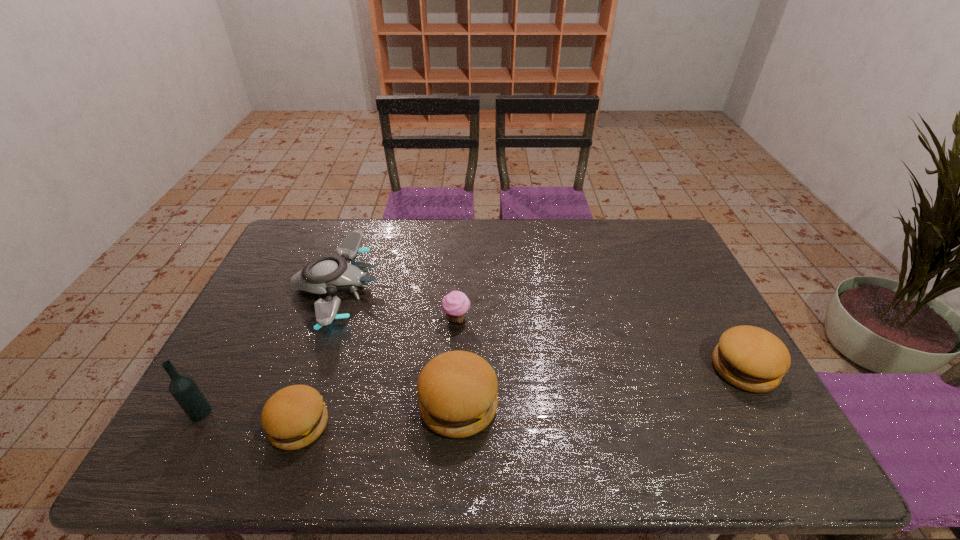
The image size is (960, 540). In order to click on free space between the second hamburger from left to right and the drone in this screenshot , I will do `click(398, 346)`.

Locate an element on the screen. vacant point located between the cupcake and the drone is located at coordinates (397, 303).

This screenshot has width=960, height=540. In order to click on free spot between the second hamburger from left to right and the rightmost hamburger in this screenshot , I will do `click(601, 387)`.

Find the location of a particular element. The image size is (960, 540). vacant area between the drone and the cupcake is located at coordinates (397, 303).

You are a GUI agent. You are given a task and a screenshot of the screen. Output one action in this format:
    pyautogui.click(x=<x>, y=<y>)
    Task: Click on the unoccupied position between the third tallest object and the leftmost hamburger
    The height and width of the screenshot is (540, 960).
    Given the screenshot: What is the action you would take?
    pyautogui.click(x=521, y=397)

Identify the location of unoccupied position between the leftmost hamburger and the cupcake. (378, 372).

Image resolution: width=960 pixels, height=540 pixels. I want to click on free space between the cupcake and the shortest hamburger, so click(378, 372).

Where is `vacant region between the cupcake and the drone`? The width and height of the screenshot is (960, 540). vacant region between the cupcake and the drone is located at coordinates (397, 303).

Select which object is the third closest to the shortest hamburger. Please provide its 2D coordinates. Your answer should be formatted as a tuple, i.e. [(x, y)], where the tuple contains the x and y coordinates of a point satisfying the conditions above.

[(457, 390)]

This screenshot has width=960, height=540. I want to click on object that stands as the second closest to the second hamburger from left to right, so click(x=326, y=274).